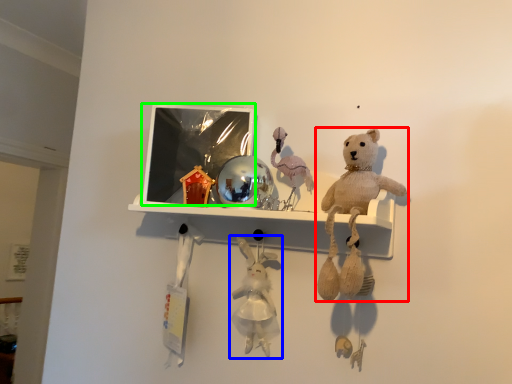
Question: Estimate the real-world distances between objects in this image. Which object is farther from teddy bear (highlighted by a red box), toy (highlighted by a blue box) or picture frame (highlighted by a green box)?

Choices:
 (A) toy
 (B) picture frame

Answer: (B)